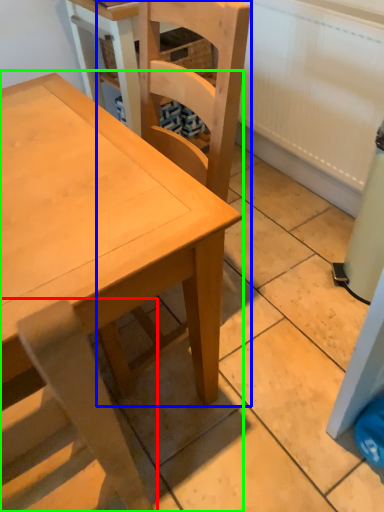
Question: Considering the real-world distances, which object is farthest from chair (highlighted by a red box)? chair (highlighted by a blue box) or table (highlighted by a green box)?

Choices:
 (A) chair
 (B) table

Answer: (A)